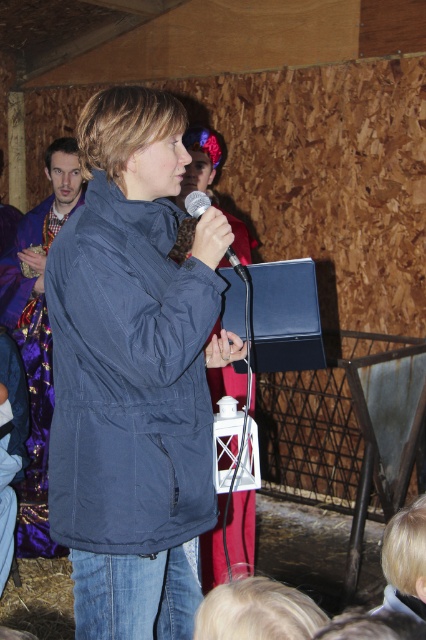
You are organizing a small event in a barn and need to place a 1.5 meter long table between the navy blue jacket at center and the purple sequined robe at left. Will there be enough space?

The navy blue jacket at center and purple sequined robe at left are 1.53 meters apart. Since the table is 1.5 meters long, there is enough space to place it between them.